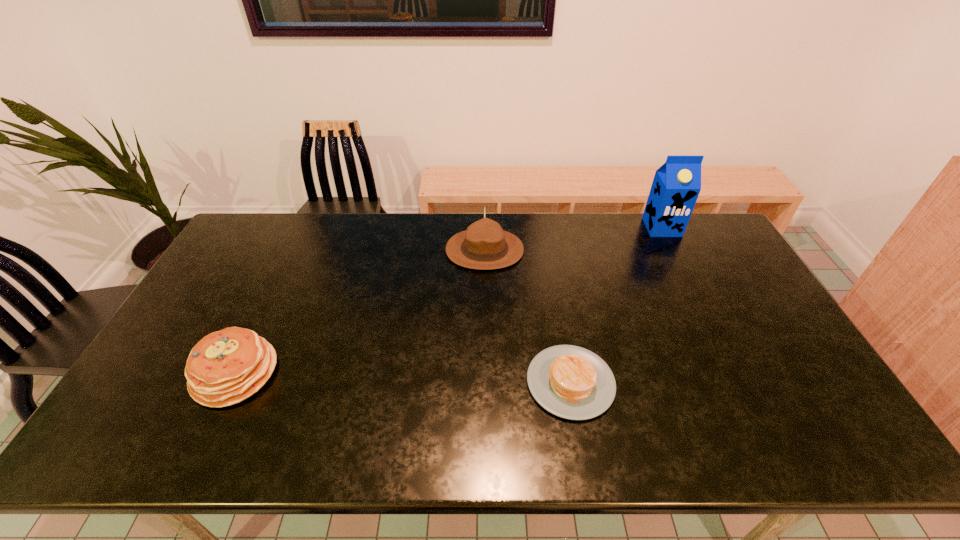
You are a GUI agent. You are given a task and a screenshot of the screen. Output one action in this format:
    pyautogui.click(x=<x>, y=<y>)
    Task: Click on the rightmost object
    The image size is (960, 540).
    Given the screenshot: What is the action you would take?
    pyautogui.click(x=676, y=185)

Image resolution: width=960 pixels, height=540 pixels. In order to click on the tallest object in this screenshot , I will do `click(676, 185)`.

Identify the location of fedora. Image resolution: width=960 pixels, height=540 pixels. (484, 245).

Identify the location of the leftmost object. [x=225, y=367].

Locate an element on the screen. This screenshot has height=540, width=960. the third tallest object is located at coordinates (225, 367).

Locate an element on the screen. the shortest object is located at coordinates (571, 382).

Where is `the right pancake`? The height and width of the screenshot is (540, 960). the right pancake is located at coordinates (571, 382).

The height and width of the screenshot is (540, 960). What are the coordinates of `vacant space located 0.280m with the cap open on the rightmost object` in the screenshot? It's located at (694, 292).

You are a GUI agent. You are given a task and a screenshot of the screen. Output one action in this format:
    pyautogui.click(x=<x>, y=<y>)
    Task: Click on the vacant space located on the feather side of the fedora
    The image size is (960, 540).
    Given the screenshot: What is the action you would take?
    pyautogui.click(x=391, y=250)

The width and height of the screenshot is (960, 540). Find the location of `vacant space located on the feather side of the fedora`. vacant space located on the feather side of the fedora is located at coordinates (374, 250).